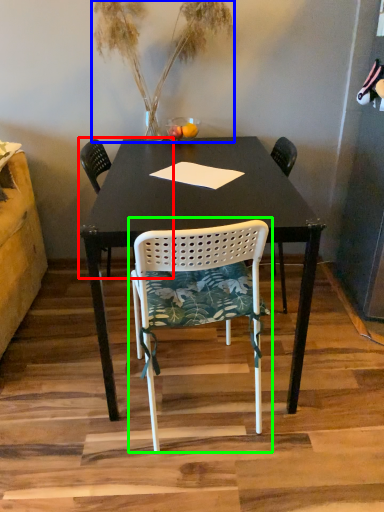
Question: Based on their relative distances, which object is farther from chair (highlighted by a red box)? Choose from houseplant (highlighted by a blue box) and chair (highlighted by a green box).

Choices:
 (A) houseplant
 (B) chair

Answer: (B)